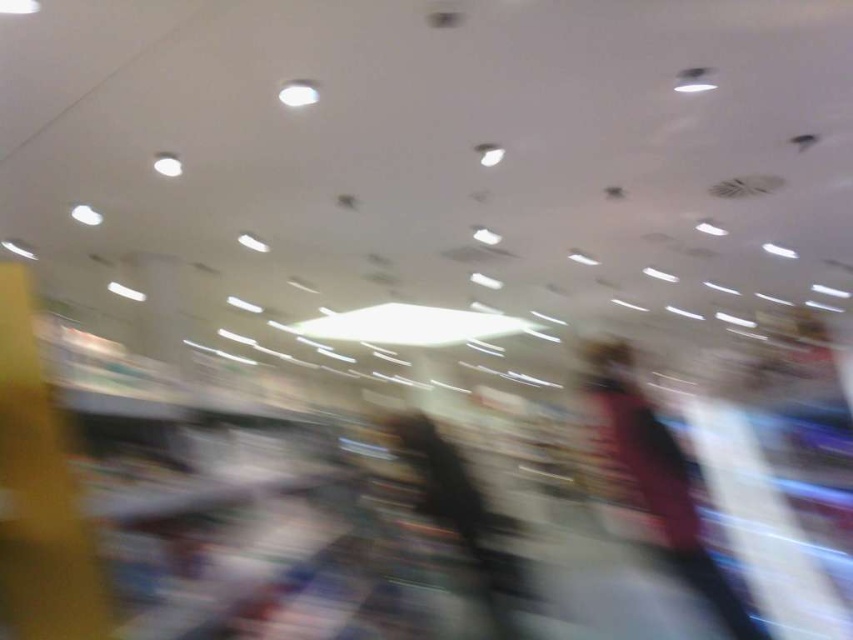
Who is more forward, [689,477] or [442,460]?

Point [689,477]

Is point (590, 394) less distant than point (503, 552)?

No.

Where is `dark pink fabric at center`? The width and height of the screenshot is (853, 640). dark pink fabric at center is located at coordinates (657, 481).

This screenshot has width=853, height=640. In order to click on dark pink fabric at center in this screenshot , I will do `click(657, 481)`.